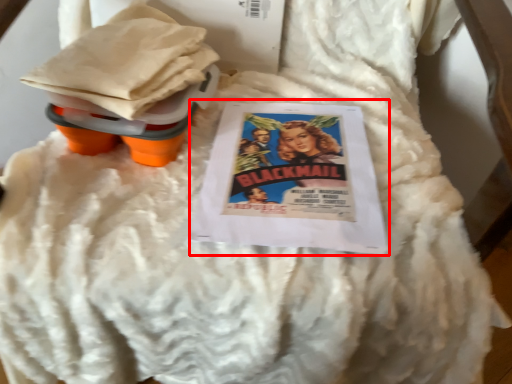
Question: From the image, what is the correct spatial relationship of comic book (annotated by the red box) in relation to toy?

Choices:
 (A) left
 (B) right

Answer: (B)